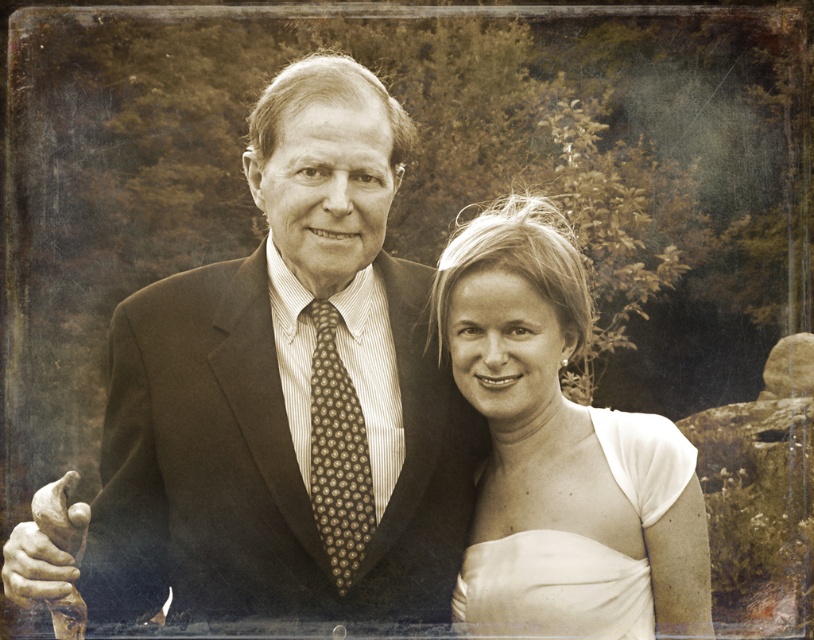
Based on the photo, who is positioned more to the left, smooth white dress at center or brown dotted tie at center?

brown dotted tie at center

Who is more distant from viewer, (554, 384) or (318, 454)?

Point (554, 384)

This screenshot has height=640, width=814. Identify the location of smooth white dress at center. (562, 445).

Is point (244, 406) less distant than point (346, 545)?

No, (244, 406) is behind (346, 545).

Is dark brown textured suit at center to the left of brown dotted tie at center from the viewer's perspective?

Yes, dark brown textured suit at center is to the left of brown dotted tie at center.

Does point (384, 611) come in front of point (322, 349)?

Yes, point (384, 611) is in front of point (322, 349).

In order to click on dark brown textured suit at center in this screenshot , I will do `click(261, 464)`.

Where is `smooth white dress at center`? The height and width of the screenshot is (640, 814). smooth white dress at center is located at coordinates (562, 445).

Identify the location of smooth white dress at center. The width and height of the screenshot is (814, 640). (562, 445).

This screenshot has height=640, width=814. In order to click on smooth white dress at center in this screenshot , I will do `click(562, 445)`.